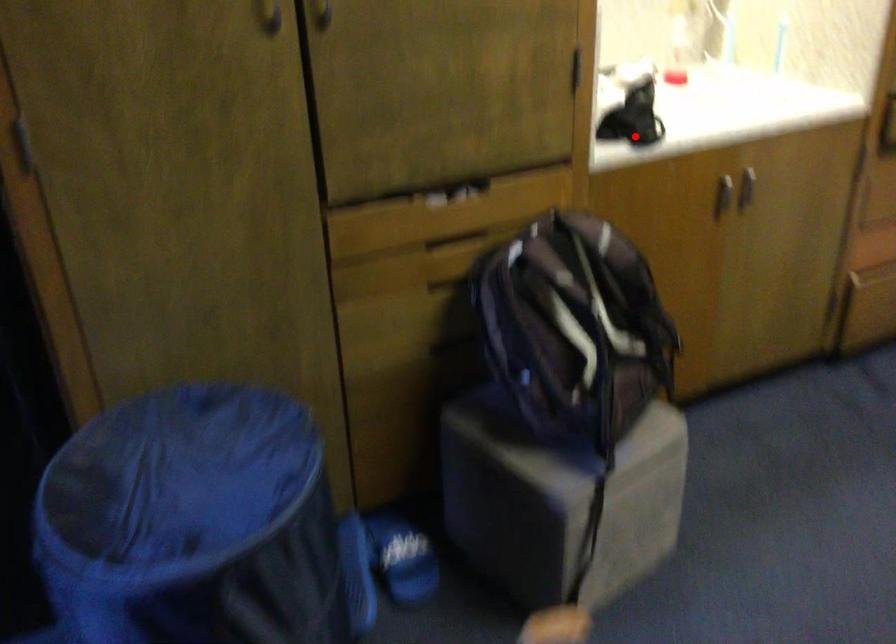
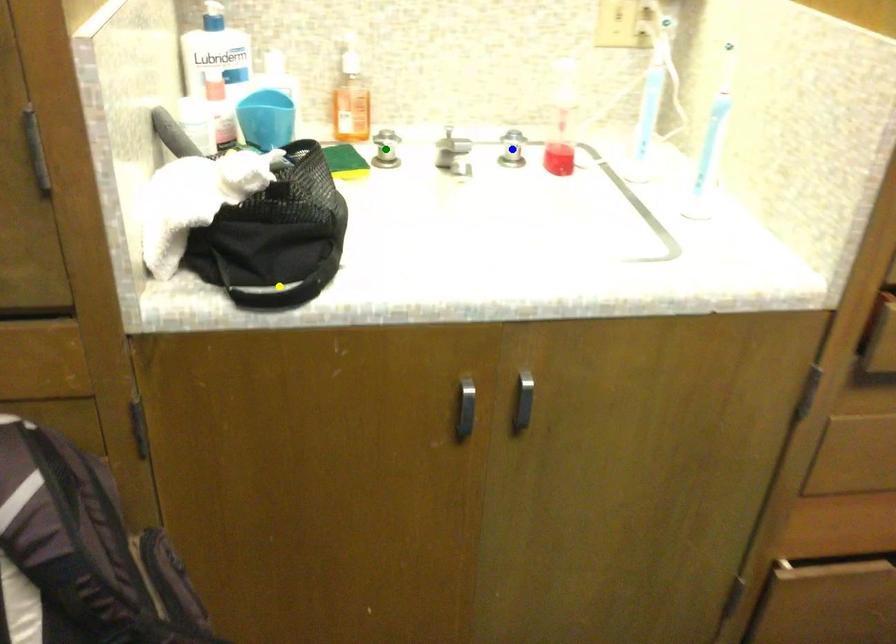
Question: I am providing you with two images of the same scene from different viewpoints. A red point is marked on the first image. You are given multiple points on the second image. Which mark in image 2 goes with the point in image 1?

Choices:
 (A) blue point
 (B) green point
 (C) yellow point

Answer: (C)